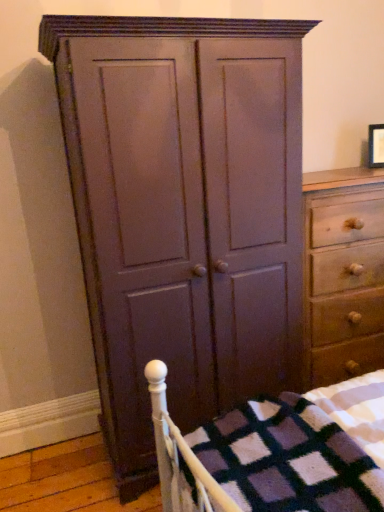
What is the approximate height of matte wood cupboard at center?

5.94 feet.

Locate an element on the screen. matte wood cupboard at center is located at coordinates (179, 218).

How far apart are matte wood cupboard at center and light brown wood chest of drawers at right?

46.74 centimeters.

Looking at this image, is matte wood cupboard at center positioned with its back to light brown wood chest of drawers at right?

No, matte wood cupboard at center's orientation is not away from light brown wood chest of drawers at right.

Can you see matte wood cupboard at center touching light brown wood chest of drawers at right?

There is a gap between matte wood cupboard at center and light brown wood chest of drawers at right.

In the scene shown: Considering the sizes of objects matte wood cupboard at center and light brown wood chest of drawers at right in the image provided, who is shorter, matte wood cupboard at center or light brown wood chest of drawers at right?

light brown wood chest of drawers at right is shorter.

Where is `picture frame on the right side of light brown wood chest of drawers at right`? This screenshot has width=384, height=512. picture frame on the right side of light brown wood chest of drawers at right is located at coordinates (376, 146).

Looking at this image, from a real-world perspective, is matte black picture frame at upper right physically located above or below light brown wood chest of drawers at right?

Clearly, from a real-world perspective, matte black picture frame at upper right is above light brown wood chest of drawers at right.

Would you say matte black picture frame at upper right contains light brown wood chest of drawers at right?

No, light brown wood chest of drawers at right is located outside of matte black picture frame at upper right.

Is there a large distance between light brown wood chest of drawers at right and matte wood cupboard at center?

No, there isn't a large distance between light brown wood chest of drawers at right and matte wood cupboard at center.

Is light brown wood chest of drawers at right shorter than matte wood cupboard at center?

Yes, light brown wood chest of drawers at right is shorter than matte wood cupboard at center.

From the image's perspective, who appears lower, light brown wood chest of drawers at right or matte wood cupboard at center?

light brown wood chest of drawers at right, from the image's perspective.

How far apart are light brown wood chest of drawers at right and matte wood cupboard at center?

They are 46.74 centimeters apart.

Is matte black picture frame at upper right positioned far away from matte wood cupboard at center?

That's right, there is a large distance between matte black picture frame at upper right and matte wood cupboard at center.

From the image's perspective, is matte black picture frame at upper right on top of matte wood cupboard at center?

Yes, from the image's perspective, matte black picture frame at upper right is on top of matte wood cupboard at center.

In terms of width, does matte black picture frame at upper right look wider or thinner when compared to matte wood cupboard at center?

matte black picture frame at upper right is thinner than matte wood cupboard at center.

At what (x,y) coordinates should I click in order to perform the action: click on cupboard below the matte black picture frame at upper right (from a real-world perspective). Please return your answer as a coordinate pair (x, y). Image resolution: width=384 pixels, height=512 pixels. Looking at the image, I should click on (179, 218).

Between point (351, 223) and point (380, 129), which one is positioned behind?

Positioned behind is point (380, 129).

Is light brown wood chest of drawers at right positioned beyond the bounds of matte black picture frame at upper right?

light brown wood chest of drawers at right lies outside matte black picture frame at upper right's area.

Is light brown wood chest of drawers at right positioned with its back to matte black picture frame at upper right?

light brown wood chest of drawers at right does not have its back to matte black picture frame at upper right.

Which is closer to the camera, (139,276) or (370,126)?

The point (139,276) is in front.

Is matte wood cupboard at center facing away from matte black picture frame at upper right?

No, matte black picture frame at upper right is not at the back of matte wood cupboard at center.

Are matte wood cupboard at center and matte black picture frame at upper right making contact?

They are not placed beside each other.

Find the location of `cupboard on the left side of light brown wood chest of drawers at right`. cupboard on the left side of light brown wood chest of drawers at right is located at coordinates (179, 218).

At what (x,y) coordinates should I click in order to perform the action: click on picture frame above the light brown wood chest of drawers at right (from the image's perspective). Please return your answer as a coordinate pair (x, y). Looking at the image, I should click on pos(376,146).

Considering their positions, is matte black picture frame at upper right positioned closer to matte wood cupboard at center than light brown wood chest of drawers at right?

light brown wood chest of drawers at right.

Considering their positions, is light brown wood chest of drawers at right positioned further to matte wood cupboard at center than matte black picture frame at upper right?

matte black picture frame at upper right is positioned further to the anchor matte wood cupboard at center.

Which object lies nearer to the anchor point matte black picture frame at upper right, light brown wood chest of drawers at right or matte wood cupboard at center?

The object closer to matte black picture frame at upper right is light brown wood chest of drawers at right.

Which object lies further to the anchor point matte black picture frame at upper right, matte wood cupboard at center or light brown wood chest of drawers at right?

Among the two, matte wood cupboard at center is located further to matte black picture frame at upper right.

Looking at the image, which one is located closer to light brown wood chest of drawers at right, matte black picture frame at upper right or matte wood cupboard at center?

matte wood cupboard at center is closer to light brown wood chest of drawers at right.

When comparing their distances from light brown wood chest of drawers at right, does matte wood cupboard at center or matte black picture frame at upper right seem closer?

Based on the image, matte wood cupboard at center appears to be nearer to light brown wood chest of drawers at right.

I want to click on chest of drawers between matte wood cupboard at center and matte black picture frame at upper right, so click(343, 274).